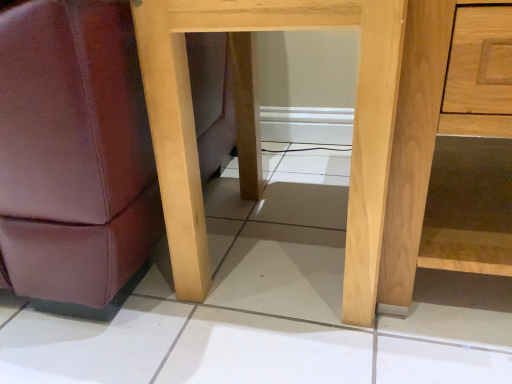
Question: From the image's perspective, is natural wood table at center above or below light brown wood dresser at right?

Choices:
 (A) above
 (B) below

Answer: (B)

Question: In terms of size, does natural wood table at center appear bigger or smaller than light brown wood dresser at right?

Choices:
 (A) big
 (B) small

Answer: (B)

Question: Is natural wood table at center to the left or to the right of light brown wood dresser at right in the image?

Choices:
 (A) right
 (B) left

Answer: (B)

Question: From the image's perspective, is light brown wood dresser at right above or below natural wood table at center?

Choices:
 (A) below
 (B) above

Answer: (B)

Question: Is light brown wood dresser at right taller or shorter than natural wood table at center?

Choices:
 (A) tall
 (B) short

Answer: (B)

Question: Is point (431, 125) positioned closer to the camera than point (183, 201)?

Choices:
 (A) farther
 (B) closer

Answer: (B)

Question: Is light brown wood dresser at right bigger or smaller than natural wood table at center?

Choices:
 (A) small
 (B) big

Answer: (B)